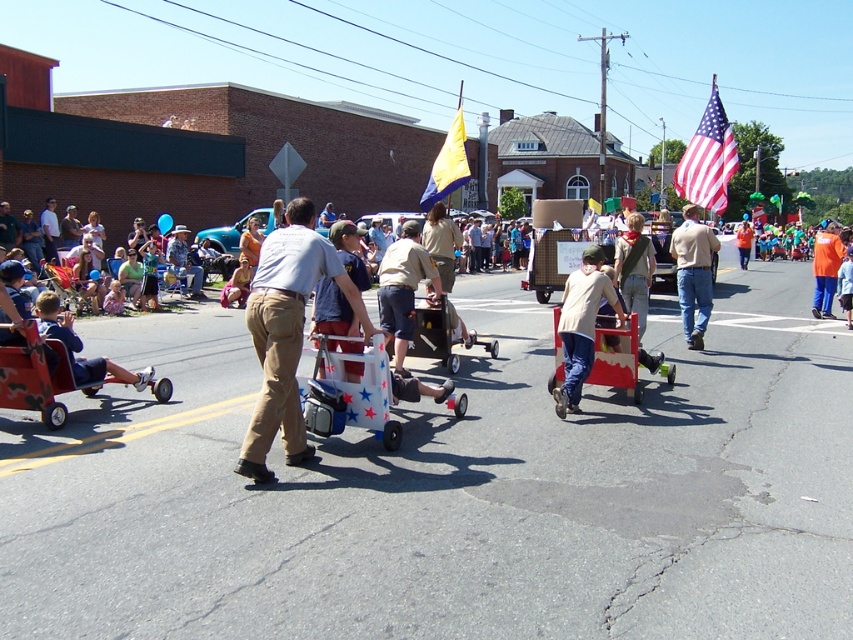
You are a participant in the parade and need to decide which cart to join. You notice the camouflage fabric wagon at lower left and the wooden cart at center. Which cart is taller?

The camouflage fabric wagon at lower left is taller than the wooden cart at center.

You are a photographer standing at the center of the street, aiming to capture the American flag at upper right in your photo. The flag is positioned at coordinates approximately 0.250 on the horizontal axis and 0.831 on the vertical axis. To ensure the flag is centered in your shot, which direction should you move? Please specify the direction as left, right, up, or down.

The American flag at upper right is located at point 0.250 on the horizontal axis and 0.831 on the vertical axis. To center it in your photo, you should move to the left and down since the flag is currently positioned to the right and above the center of the image.